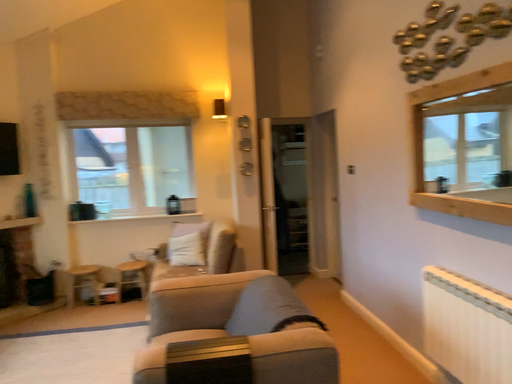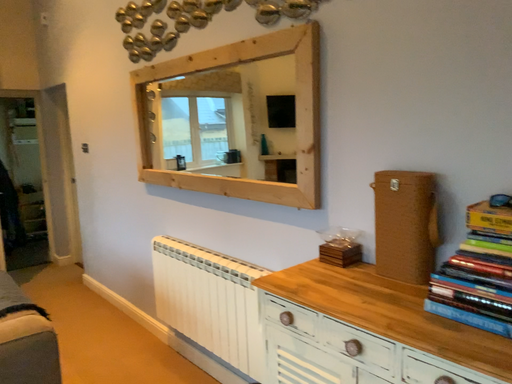
Question: Which way did the camera rotate in the video?

Choices:
 (A) rotated left
 (B) rotated right

Answer: (B)